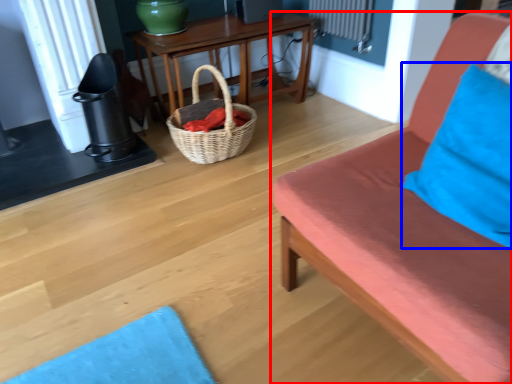
Question: Which of the following is the closest to the observer, studio couch (highlighted by a red box) or pillow (highlighted by a blue box)?

Choices:
 (A) studio couch
 (B) pillow

Answer: (A)